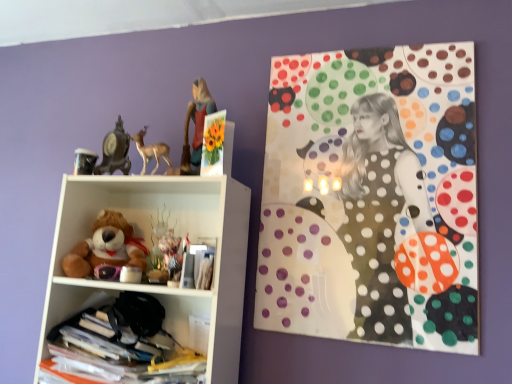
Question: Is polka dot fabric at upper right inside the boundaries of matte brown deer at upper left, or outside?

Choices:
 (A) outside
 (B) inside

Answer: (A)

Question: From the image's perspective, is polka dot fabric at upper right positioned above or below matte brown deer at upper left?

Choices:
 (A) below
 (B) above

Answer: (A)

Question: Which object is the farthest from the soft plush teddy bear at left?

Choices:
 (A) matte brown deer at upper left
 (B) translucent glass vase at upper center, the 1th toy ordered from the bottom
 (C) matte black cup at upper left, the 2th toy viewed from the top
 (D) white plastic shelf at left, acting as the 1th shelf starting from the top
 (E) polka dot fabric at upper right

Answer: (E)

Question: Estimate the real-world distances between objects in this image. Which object is closer to the matte black clock at upper left, positioned as the third toy in bottom-to-top order?

Choices:
 (A) matte black cup at upper left, placed as the 1th toy when sorted from left to right
 (B) matte plastic figurine of girl at upper center
 (C) soft plush teddy bear at left
 (D) translucent glass vase at upper center, which ranks as the 3th toy in left-to-right order
 (E) matte brown deer at upper left

Answer: (A)